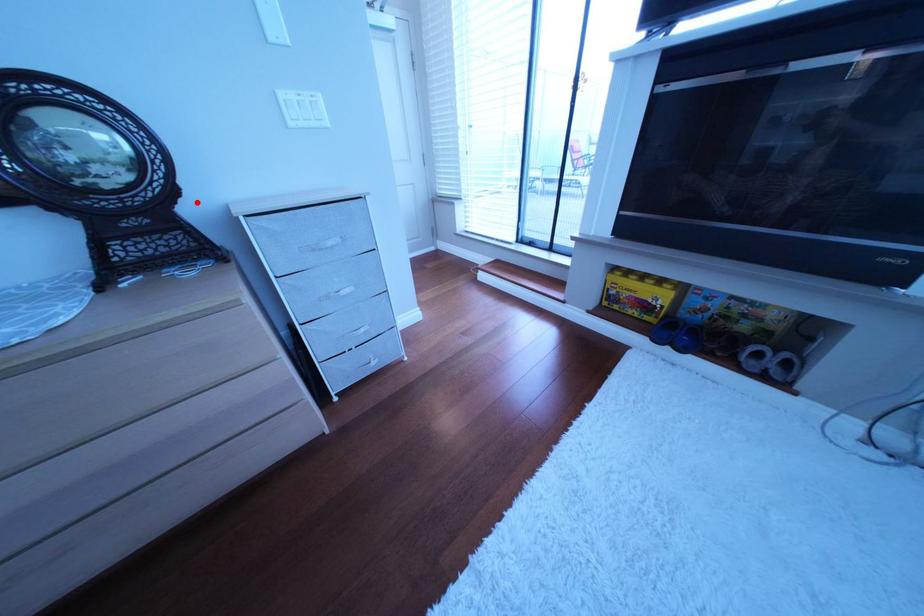
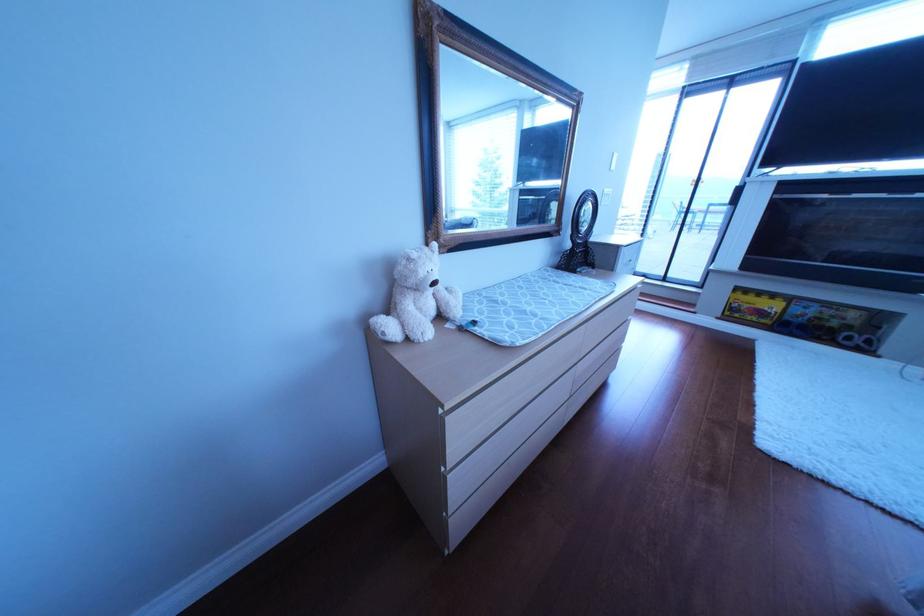
Question: I am providing you with two images of the same scene from different viewpoints. A red point is marked on the first image. At the location where the point appears in image 1, is it still visible in image 2?

Choices:
 (A) Yes
 (B) No

Answer: (A)